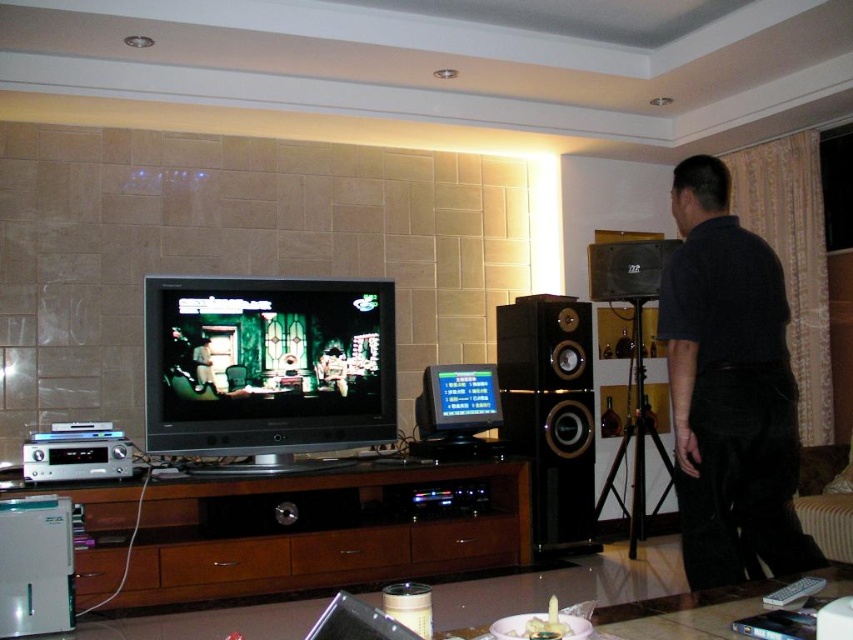
You are setting up a new shelf to display both the shiny black television at center and the black wood speaker at center. The shelf has a maximum width capacity of 1.2 meters. According to the spatial information provided, can both items fit side by side on the shelf without exceeding its width limit?

The shiny black television at center might be wider than black wood speaker at center, but without exact measurements, it is uncertain if their combined width exceeds 1.2 meters. Check the individual dimensions before placing them.

You are setting up a new shelf above the brown wood entertainment center at center and the black wood speaker at center. Which object should you position the shelf above to ensure it is higher than both?

The brown wood entertainment center at center is shorter than the black wood speaker at center, so you should position the shelf above the black wood speaker at center to ensure it is higher than both.

You are planning to place a decorative item on the entertainment unit in the living room. The dark blue shirt at center and the black wood speaker at center are already there. Which object should you move to make space if the new item is wider than both?

The dark blue shirt at center should be moved because it might be wider than the black wood speaker at center, so moving it would free up more space for the new item.